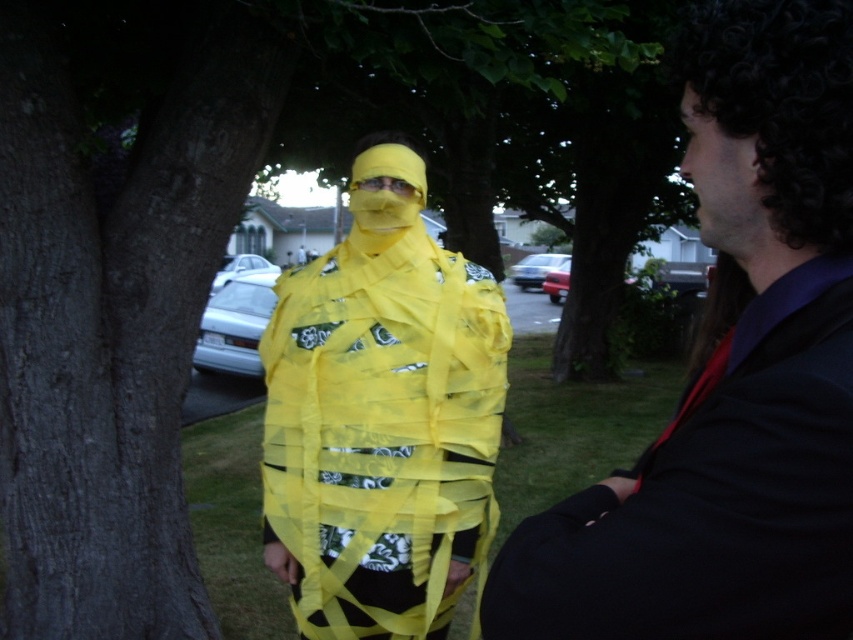
Question: Which object is farther from the camera taking this photo?

Choices:
 (A) matte yellow tape at center
 (B) shiny black suit at right

Answer: (A)

Question: Can you confirm if shiny black suit at right is bigger than matte yellow tape at center?

Choices:
 (A) yes
 (B) no

Answer: (B)

Question: Does shiny black suit at right have a lesser width compared to matte yellow tape at center?

Choices:
 (A) yes
 (B) no

Answer: (A)

Question: Which of the following is the farthest from the observer?

Choices:
 (A) (357, 227)
 (B) (767, 358)

Answer: (A)

Question: From the image, what is the correct spatial relationship of shiny black suit at right in relation to matte yellow tape at center?

Choices:
 (A) below
 (B) above

Answer: (B)

Question: Which point appears farthest from the camera in this image?

Choices:
 (A) (341, 337)
 (B) (804, 301)

Answer: (A)